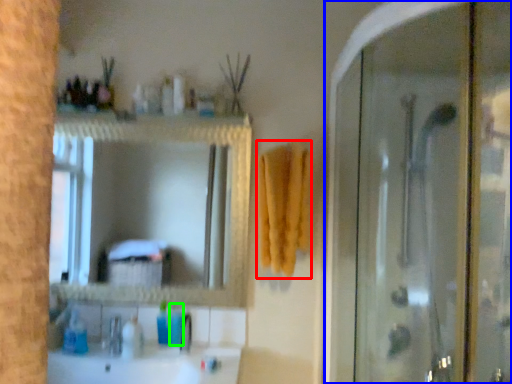
Question: Considering the real-world distances, which object is farthest from bath towel (highlighted by a red box)? screen door (highlighted by a blue box) or toiletry (highlighted by a green box)?

Choices:
 (A) screen door
 (B) toiletry

Answer: (B)